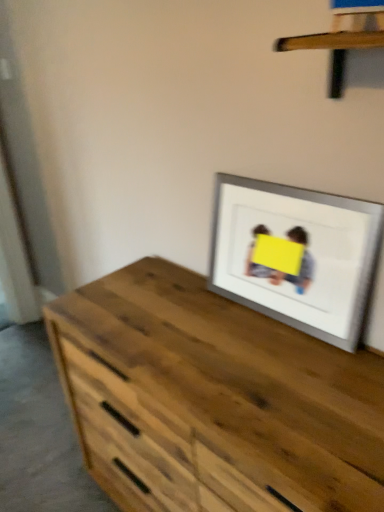
Question: Is silver/metallic picture frame at upper right situated inside wooden at upper center or outside?

Choices:
 (A) inside
 (B) outside

Answer: (B)

Question: From a real-world perspective, is silver/metallic picture frame at upper right physically located above or below wooden at upper center?

Choices:
 (A) below
 (B) above

Answer: (A)

Question: Which is nearer to the silver/metallic picture frame at upper right?

Choices:
 (A) wooden chest of drawers at center
 (B) wooden at upper center

Answer: (A)

Question: Estimate the real-world distances between objects in this image. Which object is closer to the wooden at upper center?

Choices:
 (A) silver/metallic picture frame at upper right
 (B) wooden chest of drawers at center

Answer: (A)